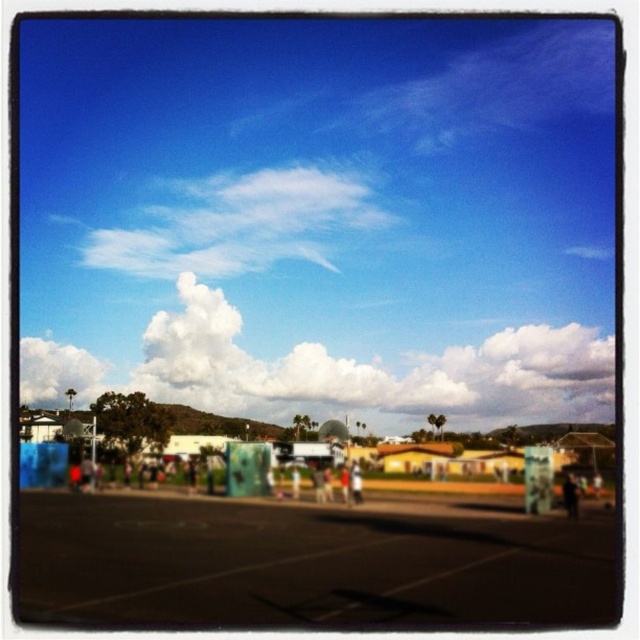
Does white fluffy cloud at center have a greater height compared to white fluffy cloud at upper center?

Yes, white fluffy cloud at center is taller than white fluffy cloud at upper center.

Is point (35, 401) more distant than point (202, 230)?

No.

Image resolution: width=640 pixels, height=640 pixels. In order to click on white fluffy cloud at center in this screenshot , I will do `click(337, 371)`.

Is black asphalt parking lot at lower left wider than white fluffy cloud at upper left?

Indeed, black asphalt parking lot at lower left has a greater width compared to white fluffy cloud at upper left.

Is point (100, 504) in front of point (26, 362)?

Yes, point (100, 504) is closer to viewer.

Where is `black asphalt parking lot at lower left`? The image size is (640, 640). black asphalt parking lot at lower left is located at coordinates 308,563.

Does point (186, 212) lie in front of point (88, 388)?

No, (186, 212) is behind (88, 388).

Locate an element on the screen. white fluffy cloud at upper center is located at coordinates (237, 224).